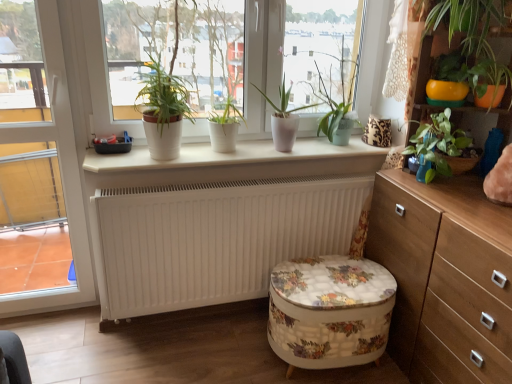
Where is `free spot in front of white glossy door at left`? free spot in front of white glossy door at left is located at coordinates tap(46, 344).